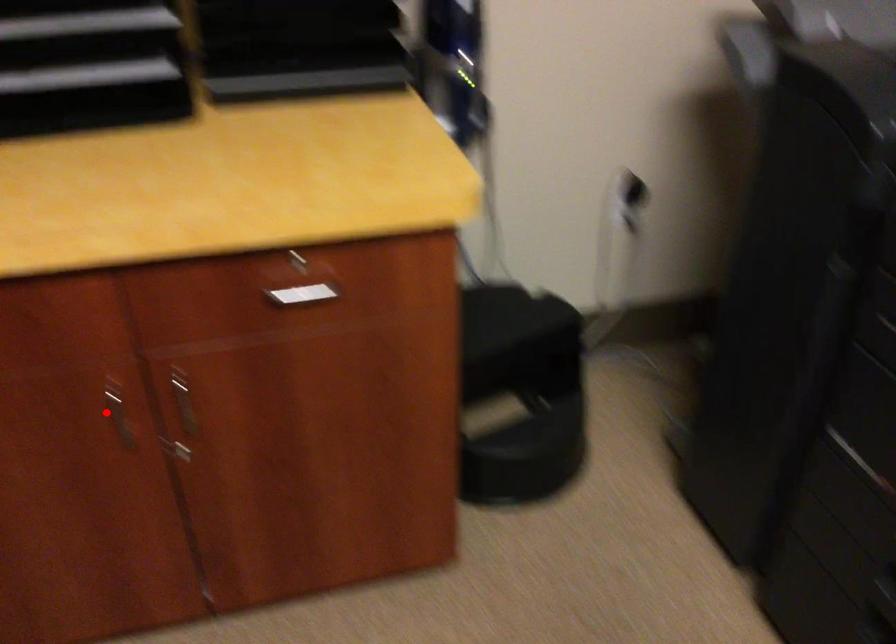
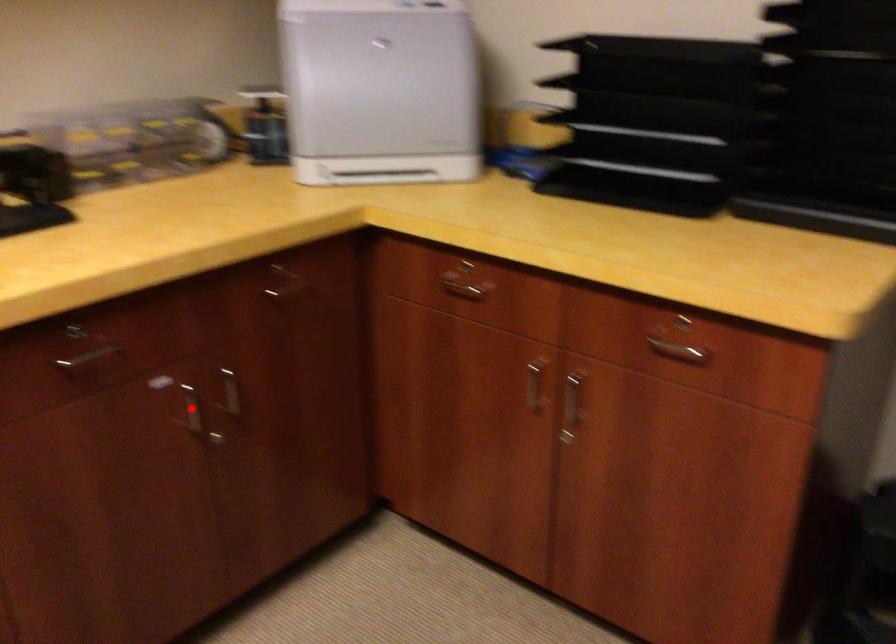
I am providing you with two images of the same scene from different viewpoints. A red point is marked on the first image and another point is marked on the second image. Are the points marked in image1 and image2 representing the same 3D position?

No